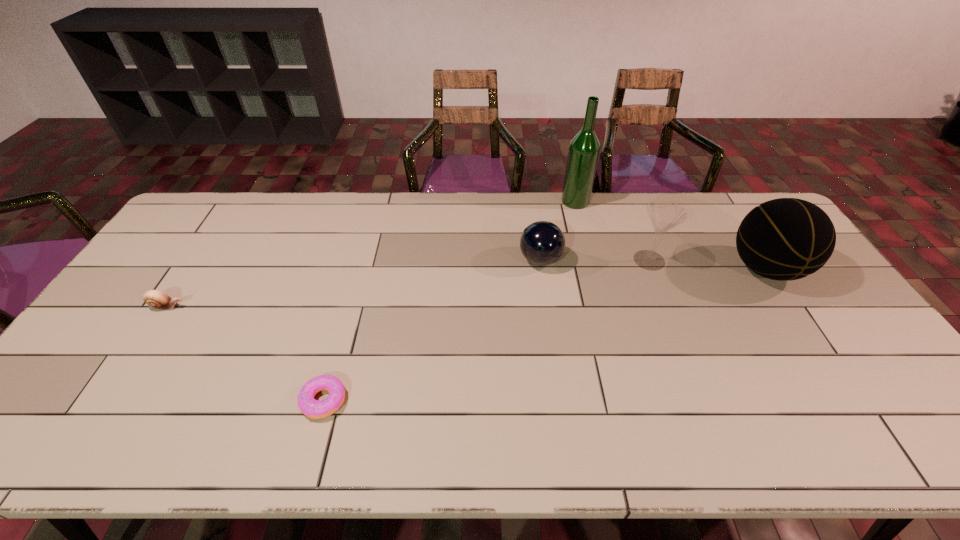
Identify the location of the third object from right to left. This screenshot has width=960, height=540. (584, 149).

At what (x,y) coordinates should I click in order to perform the action: click on the farthest object. Please return your answer as a coordinate pair (x, y). Looking at the image, I should click on (584, 149).

The width and height of the screenshot is (960, 540). I want to click on basketball, so click(783, 239).

Image resolution: width=960 pixels, height=540 pixels. In order to click on the rightmost object in this screenshot , I will do `click(783, 239)`.

Where is `the fifth object from left to right`? This screenshot has width=960, height=540. the fifth object from left to right is located at coordinates (664, 215).

Locate an element on the screen. The width and height of the screenshot is (960, 540). the fourth shortest object is located at coordinates (664, 215).

Find the location of `the fourth tallest object`. the fourth tallest object is located at coordinates (542, 243).

In order to click on bowling ball in this screenshot , I will do `click(542, 243)`.

At what (x,y) coordinates should I click in order to perform the action: click on escargot. Please return your answer as a coordinate pair (x, y). The height and width of the screenshot is (540, 960). Looking at the image, I should click on (155, 299).

You are a GUI agent. You are given a task and a screenshot of the screen. Output one action in this format:
    pyautogui.click(x=<x>, y=<y>)
    Task: Click on the fifth tallest object
    
    Given the screenshot: What is the action you would take?
    pyautogui.click(x=155, y=299)